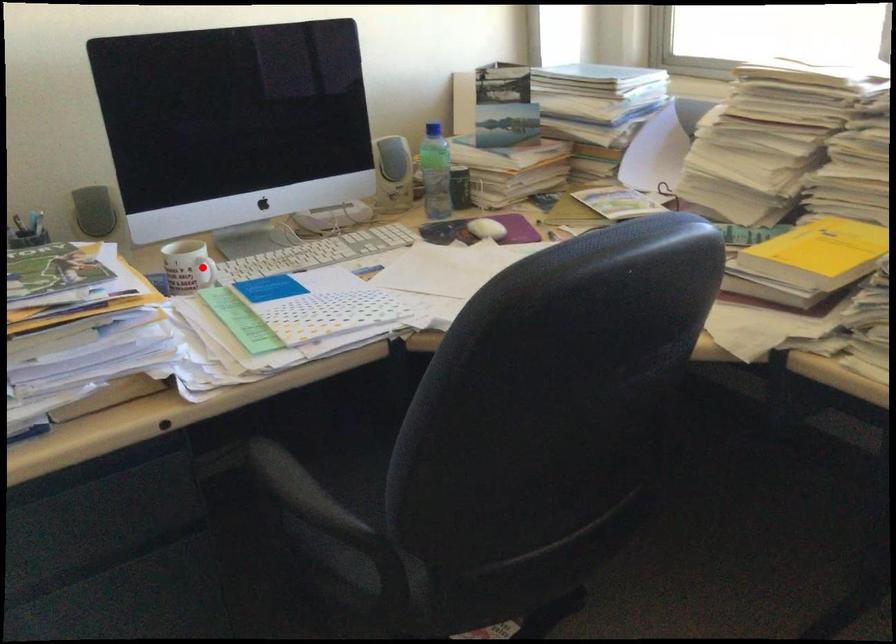
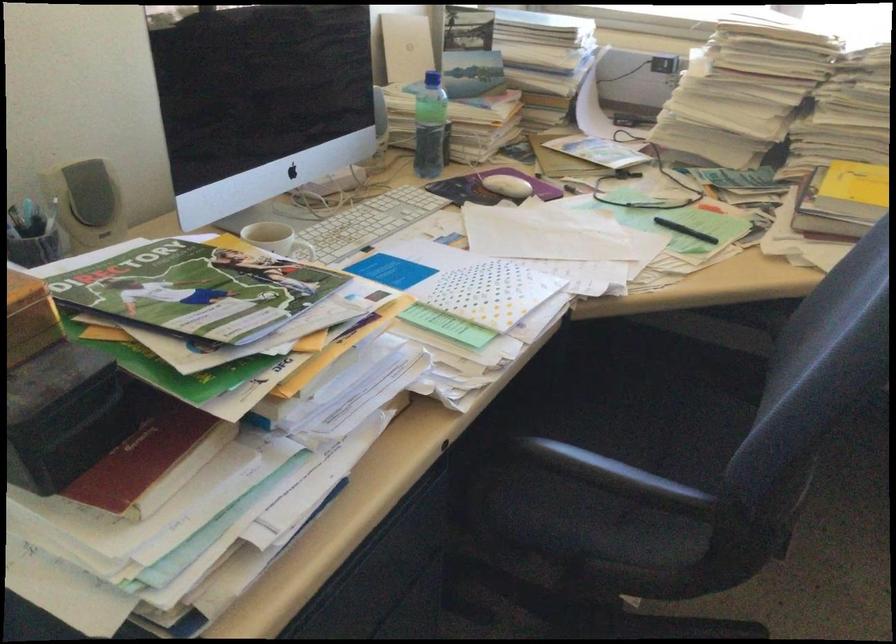
In the second image, find the point that corresponds to the highlighted location in the first image.

(306, 252)